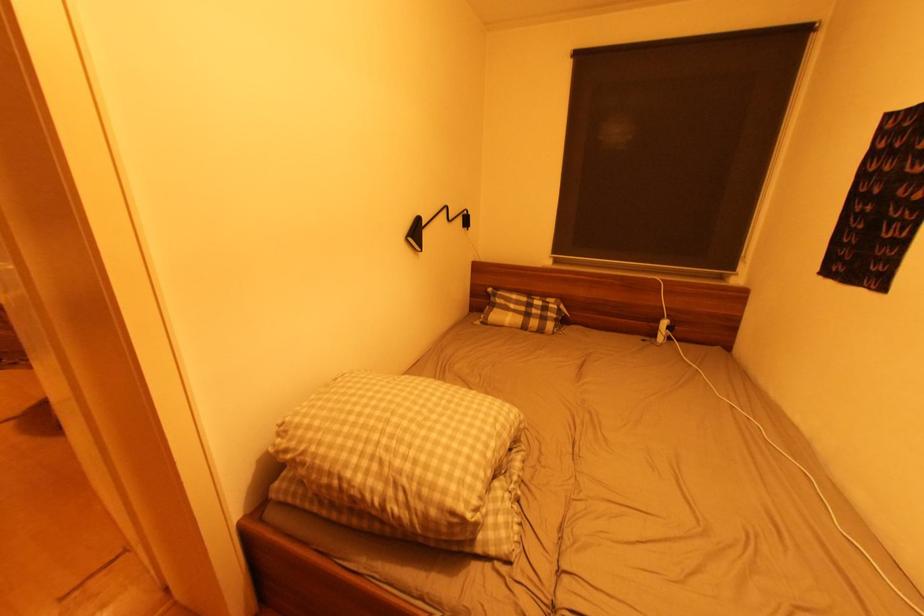
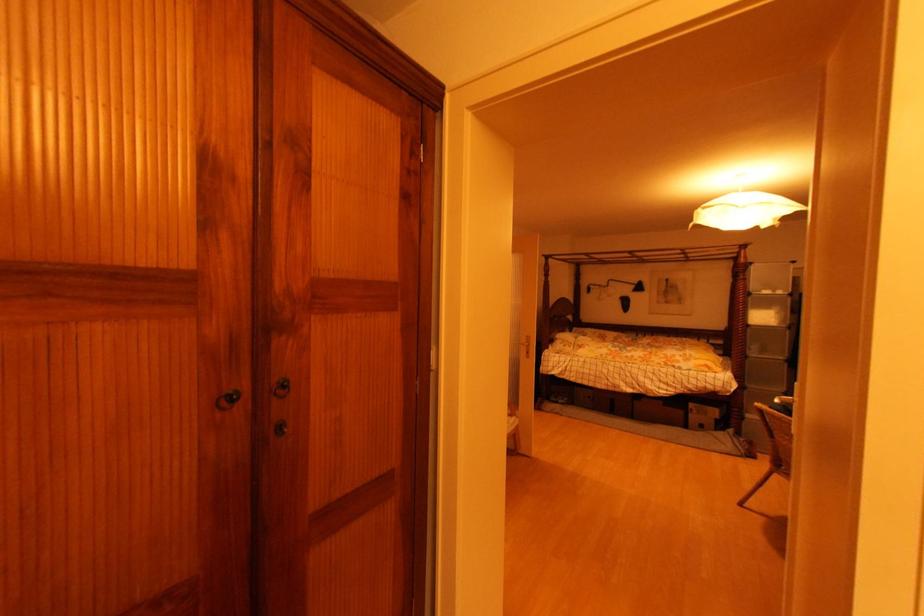
Question: The camera is either moving clockwise (left) or counter-clockwise (right) around the object. The first image is from the beginning of the video and the second image is from the end. Is the camera moving left or right when shooting the video?

Choices:
 (A) Left
 (B) Right

Answer: (B)